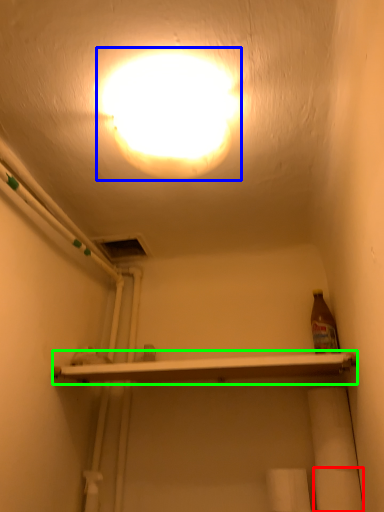
Question: Based on their relative distances, which object is nearer to toilet paper (highlighted by a red box)? Choose from lamp (highlighted by a blue box) and shelf (highlighted by a green box).

Choices:
 (A) lamp
 (B) shelf

Answer: (B)